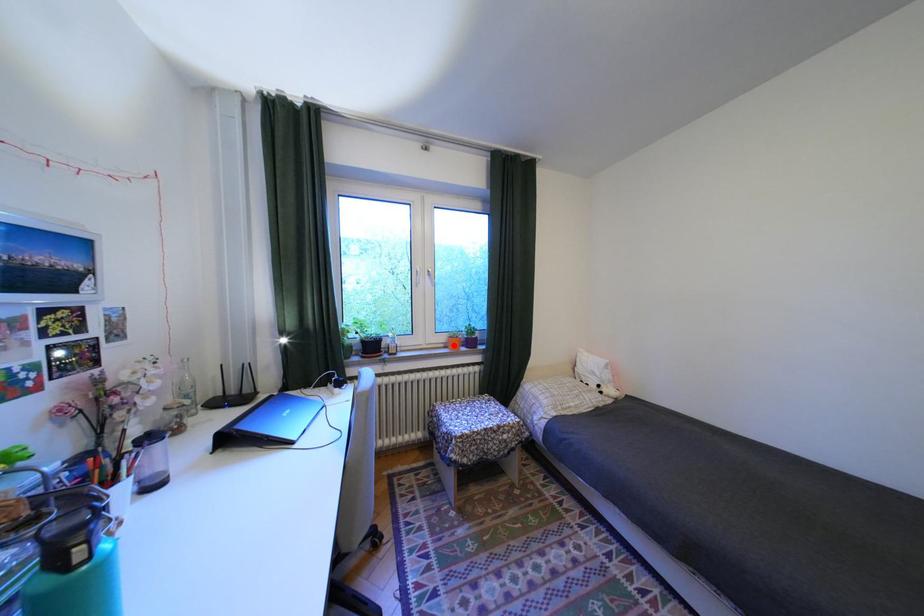
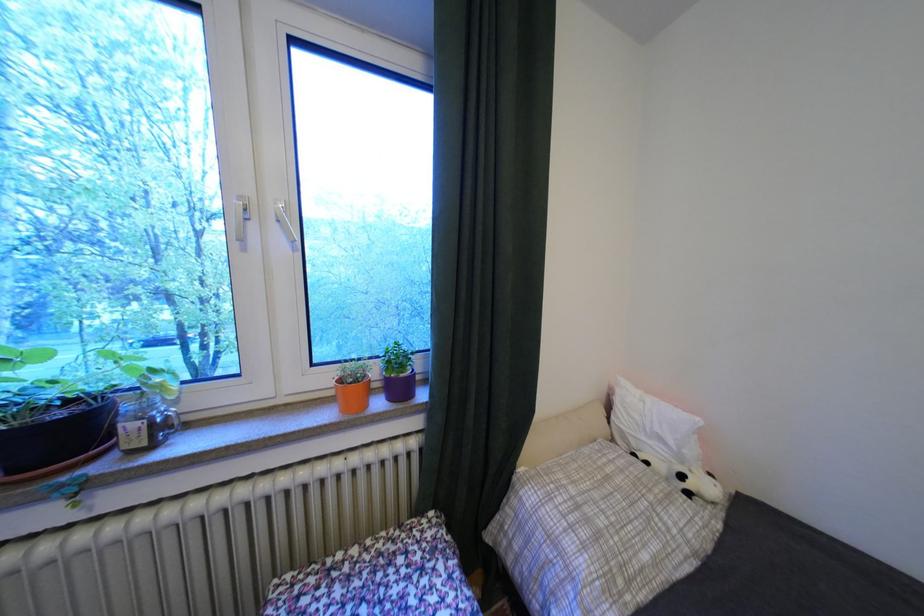
Question: I am providing you with two images of the same scene from different viewpoints. A red point is marked on the first image. At the location where the point appears in image 1, is it still visible in image 2?

Choices:
 (A) Yes
 (B) No

Answer: (A)